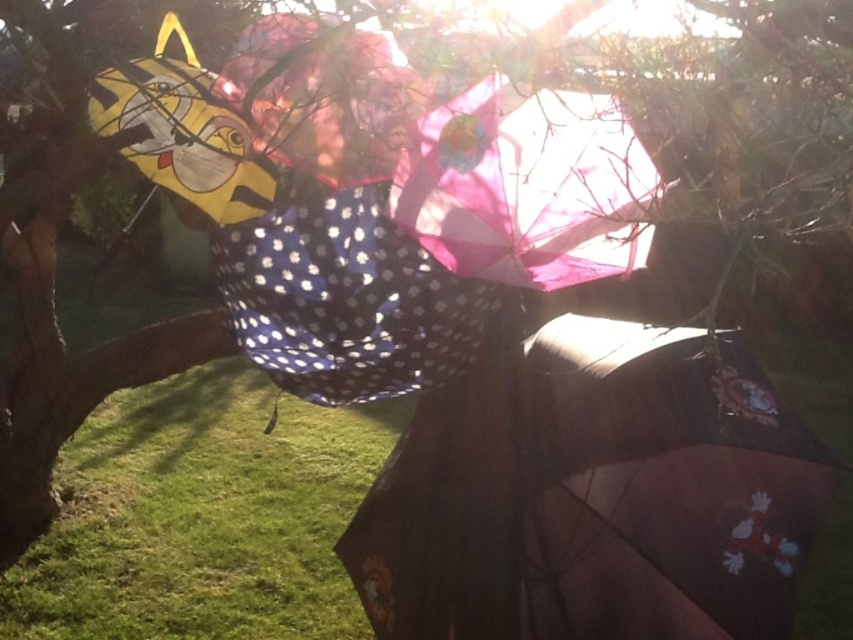
Question: From the image, what is the correct spatial relationship of green grass at lower left in relation to polka dot fabric umbrella at center?

Choices:
 (A) above
 (B) below

Answer: (B)

Question: Is dark brown matte umbrella at lower right to the left of green grass at lower left from the viewer's perspective?

Choices:
 (A) yes
 (B) no

Answer: (B)

Question: Which point is farther to the camera?

Choices:
 (A) green grass at lower left
 (B) pink polka dot umbrella at center
 (C) dark brown matte umbrella at lower right
 (D) yellow matte kite at upper left

Answer: (A)

Question: Can you confirm if polka dot fabric umbrella at center is positioned to the right of pink polka dot umbrella at center?

Choices:
 (A) yes
 (B) no

Answer: (A)

Question: Which point is closer to the camera taking this photo?

Choices:
 (A) (94, 77)
 (B) (268, 54)

Answer: (B)

Question: Which point is farther to the camera?

Choices:
 (A) green grass at lower left
 (B) pink sheer umbrella at upper center
 (C) pink polka dot umbrella at center

Answer: (A)